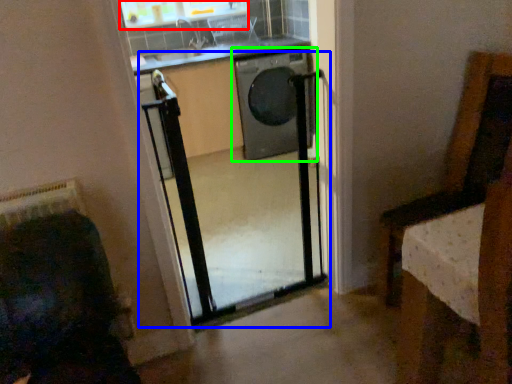
Question: Considering the real-world distances, which object is closest to window (highlighted by a red box)? screen door (highlighted by a blue box) or washing machine (highlighted by a green box).

Choices:
 (A) screen door
 (B) washing machine

Answer: (B)